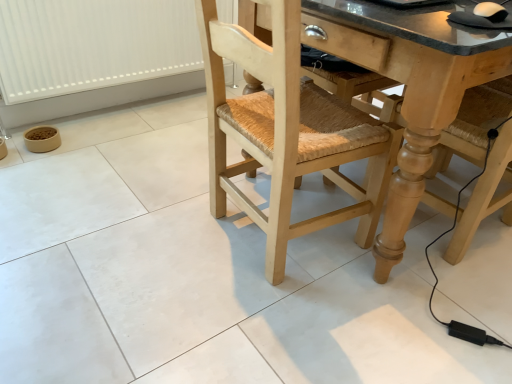
Question: Could natural wood chair at center be considered to be inside granite countertop at center?

Choices:
 (A) yes
 (B) no

Answer: (A)

Question: Is granite countertop at center aimed at natural wood chair at center?

Choices:
 (A) no
 (B) yes

Answer: (B)

Question: From a real-world perspective, is granite countertop at center under natural wood chair at center?

Choices:
 (A) yes
 (B) no

Answer: (A)

Question: Is granite countertop at center taller than natural wood chair at center?

Choices:
 (A) no
 (B) yes

Answer: (A)

Question: Can you confirm if granite countertop at center is positioned to the left of natural wood chair at center?

Choices:
 (A) no
 (B) yes

Answer: (A)

Question: From the image's perspective, relative to white plastic radiator at lower left, is granite countertop at center above or below?

Choices:
 (A) below
 (B) above

Answer: (A)

Question: Is point (370, 23) positioned closer to the camera than point (35, 56)?

Choices:
 (A) closer
 (B) farther

Answer: (A)

Question: Is granite countertop at center taller or shorter than white plastic radiator at lower left?

Choices:
 (A) short
 (B) tall

Answer: (B)

Question: Which is correct: granite countertop at center is inside white plastic radiator at lower left, or outside of it?

Choices:
 (A) outside
 (B) inside

Answer: (A)

Question: In terms of size, does natural wood chair at center appear bigger or smaller than granite countertop at center?

Choices:
 (A) small
 (B) big

Answer: (A)

Question: From the image's perspective, is natural wood chair at center above or below granite countertop at center?

Choices:
 (A) below
 (B) above

Answer: (A)

Question: Which is correct: natural wood chair at center is inside granite countertop at center, or outside of it?

Choices:
 (A) inside
 (B) outside

Answer: (A)

Question: Considering the relative positions of natural wood chair at center and granite countertop at center in the image provided, is natural wood chair at center to the left or to the right of granite countertop at center?

Choices:
 (A) left
 (B) right

Answer: (A)

Question: Would you say granite countertop at center is inside or outside natural wood chair at center?

Choices:
 (A) inside
 (B) outside

Answer: (B)

Question: Does point (391, 205) appear closer or farther from the camera than point (293, 29)?

Choices:
 (A) farther
 (B) closer

Answer: (A)